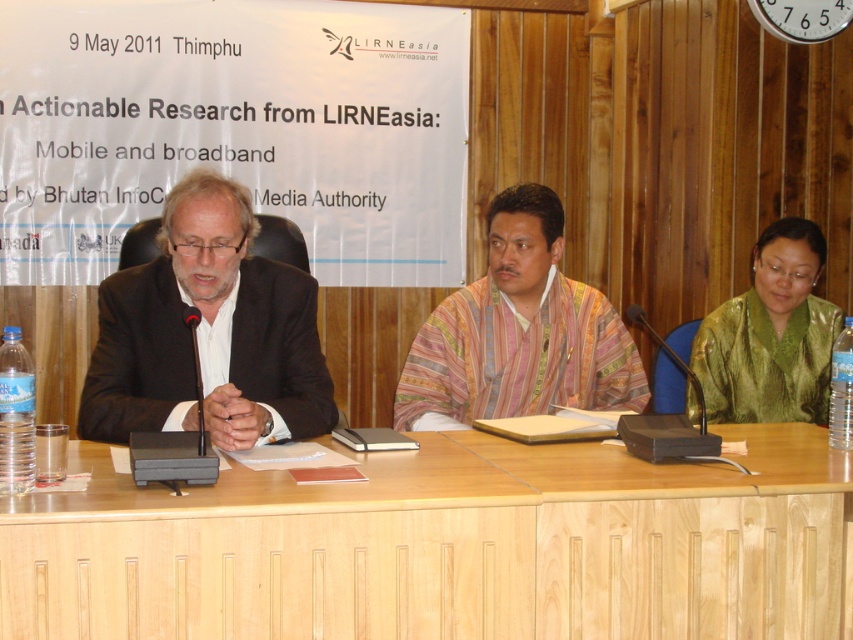
What are the coordinates of `multicolored woven fabric at center` in the screenshot? It's located at (518, 332).

Can you confirm if multicolored woven fabric at center is taller than green silk jacket at right?

Correct, multicolored woven fabric at center is much taller as green silk jacket at right.

Does point (556, 259) come farther from viewer compared to point (764, 244)?

No.

Identify the location of multicolored woven fabric at center. The image size is (853, 640). (518, 332).

From the picture: Is light brown wood table at center further to camera compared to black matte suit at left?

No, it is not.

Between light brown wood table at center and black matte suit at left, which one appears on the left side from the viewer's perspective?

black matte suit at left

Between point (589, 538) and point (244, 237), which one is positioned behind?

The point (244, 237) is behind.

This screenshot has width=853, height=640. I want to click on light brown wood table at center, so click(445, 547).

Does light brown wood table at center have a larger size compared to multicolored woven fabric at center?

Yes, light brown wood table at center is bigger than multicolored woven fabric at center.

Does light brown wood table at center have a greater width compared to multicolored woven fabric at center?

Yes, light brown wood table at center is wider than multicolored woven fabric at center.

The height and width of the screenshot is (640, 853). What do you see at coordinates (445, 547) in the screenshot?
I see `light brown wood table at center` at bounding box center [445, 547].

You are a GUI agent. You are given a task and a screenshot of the screen. Output one action in this format:
    pyautogui.click(x=<x>, y=<y>)
    Task: Click on the light brown wood table at center
    
    Given the screenshot: What is the action you would take?
    pyautogui.click(x=445, y=547)